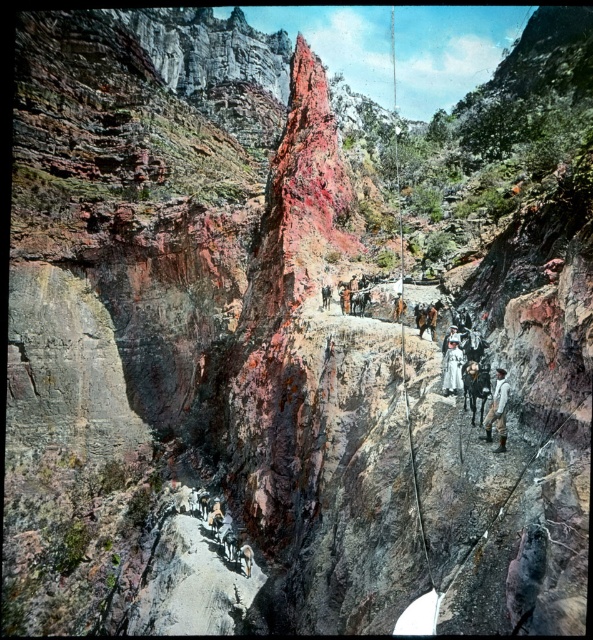
Based on the coordinates provided, where exactly is the light brown leather pants at lower right located in the image?

The light brown leather pants at lower right is located at the 2D coordinates point (498, 410).

You are a traveler in this canyon scene. You want to move from the point at coordinates (498, 449) to the point at (444, 374). Which direction should you face to walk towards your destination?

You should face towards the direction opposite of the point at (498, 449) since point (498, 449) is in front of point (444, 374). This means the destination is behind the starting point, so you need to walk in the reverse direction.

You are standing at the edge of the canyon and want to take a photo that includes both the point at coordinates point (x=479, y=426) and point (x=454, y=353). Which point will appear larger in your photo?

Point (x=479, y=426) is closer to the camera than point (x=454, y=353), so it will appear larger in the photo.